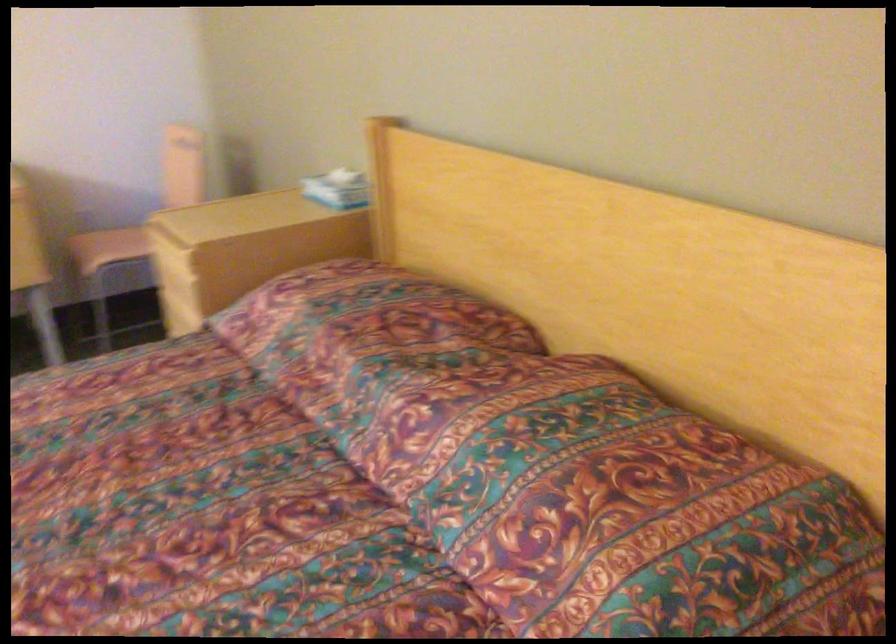
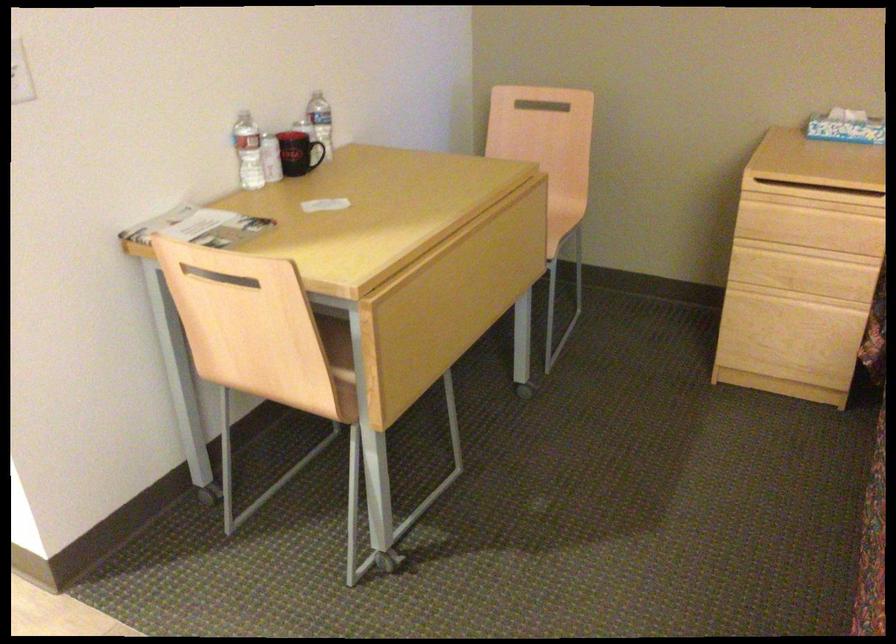
Where in the second image is the point corresponding to point (170, 243) from the first image?

(814, 196)